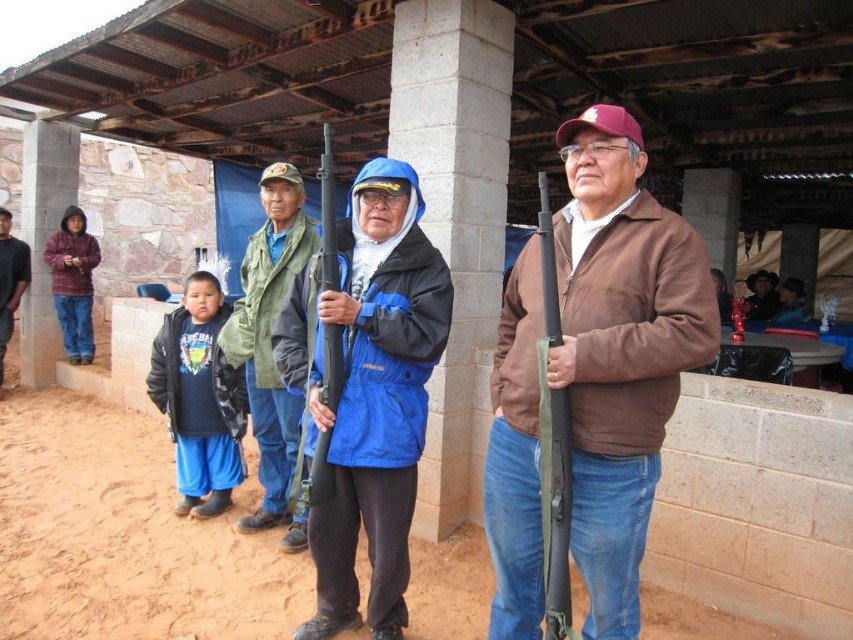
Question: Does dark blue fleece jacket at center have a lesser width compared to brown leather jacket at center?

Choices:
 (A) no
 (B) yes

Answer: (B)

Question: Which object is positioned farthest from the dark blue fleece jacket at center?

Choices:
 (A) brown matte jacket at center
 (B) green fabric jacket at center
 (C) black matte shotgun at center

Answer: (A)

Question: Which is nearer to the black matte shotgun at center?

Choices:
 (A) brown matte jacket at center
 (B) plaid hoodie at left
 (C) brown leather jacket at center

Answer: (A)

Question: Can you confirm if dark blue fleece jacket at center is wider than brown leather jacket at center?

Choices:
 (A) yes
 (B) no

Answer: (B)

Question: Is green fabric jacket at center wider than matte black shotgun at right?

Choices:
 (A) no
 (B) yes

Answer: (B)

Question: Among these points, which one is farthest from the camera?

Choices:
 (A) (331, 465)
 (B) (758, 280)
 (C) (96, 250)

Answer: (B)